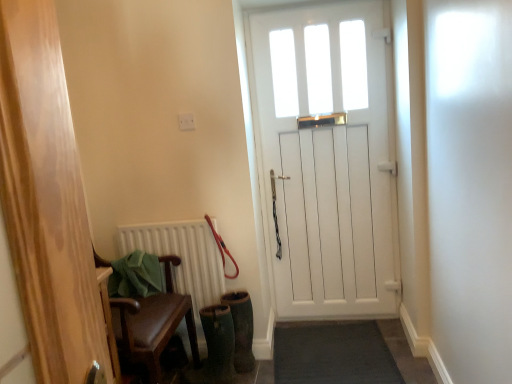
I want to click on vacant point above dark gray carpet at lower center (from a real-world perspective), so coord(334,349).